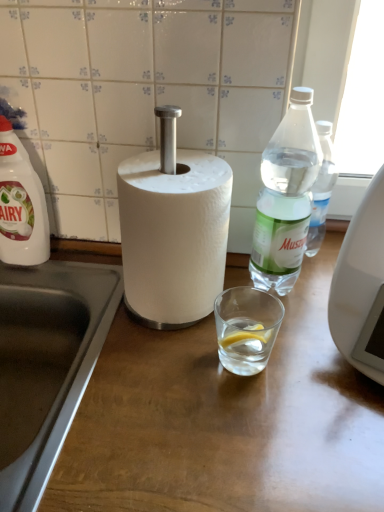
Question: Considering the positions of wooden at center and white plastic bottle at left, the first bottle viewed from the left, in the image, is wooden at center wider or thinner than white plastic bottle at left, the first bottle viewed from the left,?

Choices:
 (A) thin
 (B) wide

Answer: (B)

Question: From the image's perspective, is wooden at center positioned above or below white plastic bottle at left, the first bottle viewed from the left?

Choices:
 (A) below
 (B) above

Answer: (A)

Question: Considering the real-world distances, which object is farthest from the clear plastic bottle at right, the 2th bottle viewed from the left?

Choices:
 (A) white plastic bottle at left, marked as the second bottle in a right-to-left arrangement
 (B) stainless steel sink at lower left
 (C) wooden at center

Answer: (A)

Question: Estimate the real-world distances between objects in this image. Which object is farther from the wooden at center?

Choices:
 (A) clear plastic bottle at right, marked as the first bottle in a right-to-left arrangement
 (B) stainless steel sink at lower left
 (C) white plastic bottle at left, marked as the second bottle in a right-to-left arrangement

Answer: (C)